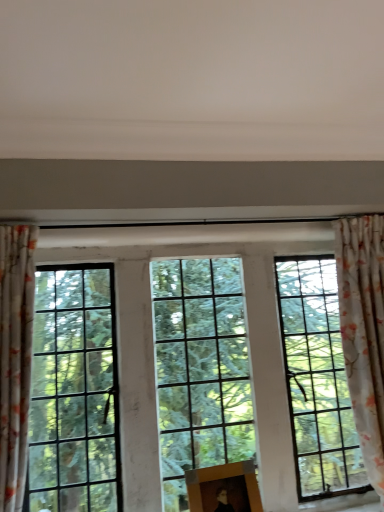
Question: Considering the positions of floral fabric curtain at left, positioned as the first curtain in front-to-back order, and floral fabric curtain at right, which appears as the second curtain when viewed from the left, in the image, is floral fabric curtain at left, positioned as the first curtain in front-to-back order, wider or thinner than floral fabric curtain at right, which appears as the second curtain when viewed from the left,?

Choices:
 (A) wide
 (B) thin

Answer: (A)

Question: Considering the relative positions of floral fabric curtain at left, which is the 2th curtain from back to front, and floral fabric curtain at right, marked as the first curtain in a back-to-front arrangement, in the image provided, is floral fabric curtain at left, which is the 2th curtain from back to front, to the left or to the right of floral fabric curtain at right, marked as the first curtain in a back-to-front arrangement,?

Choices:
 (A) right
 (B) left

Answer: (B)

Question: Estimate the real-world distances between objects in this image. Which object is farther from the floral fabric curtain at left, positioned as the first curtain in front-to-back order?

Choices:
 (A) clear glass window at center
 (B) floral fabric curtain at right, which is the 2th curtain from front to back
 (C) wooden picture frame at center

Answer: (B)

Question: Estimate the real-world distances between objects in this image. Which object is farther from the floral fabric curtain at left, the second curtain positioned from the right?

Choices:
 (A) clear glass window at center
 (B) floral fabric curtain at right, marked as the first curtain in a back-to-front arrangement
 (C) wooden picture frame at center

Answer: (B)